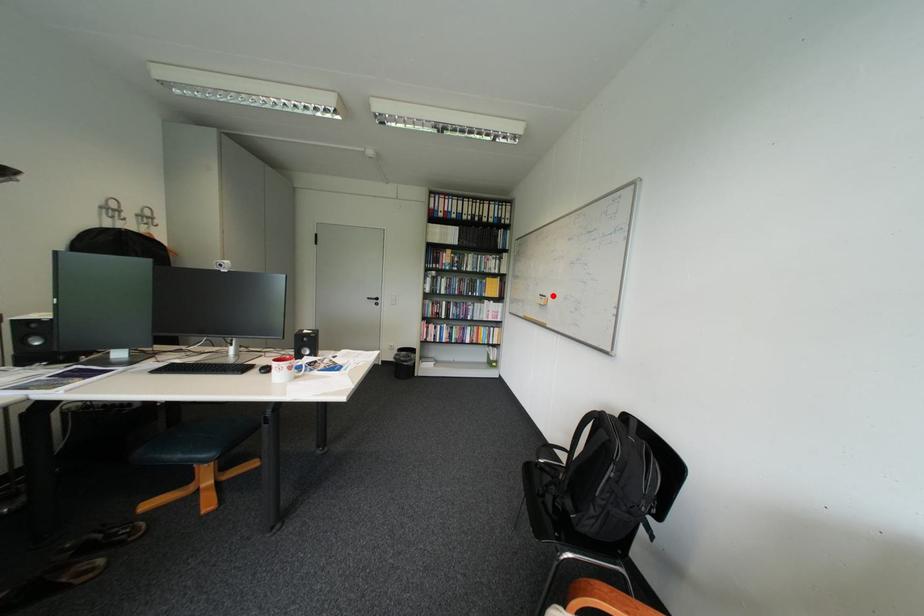
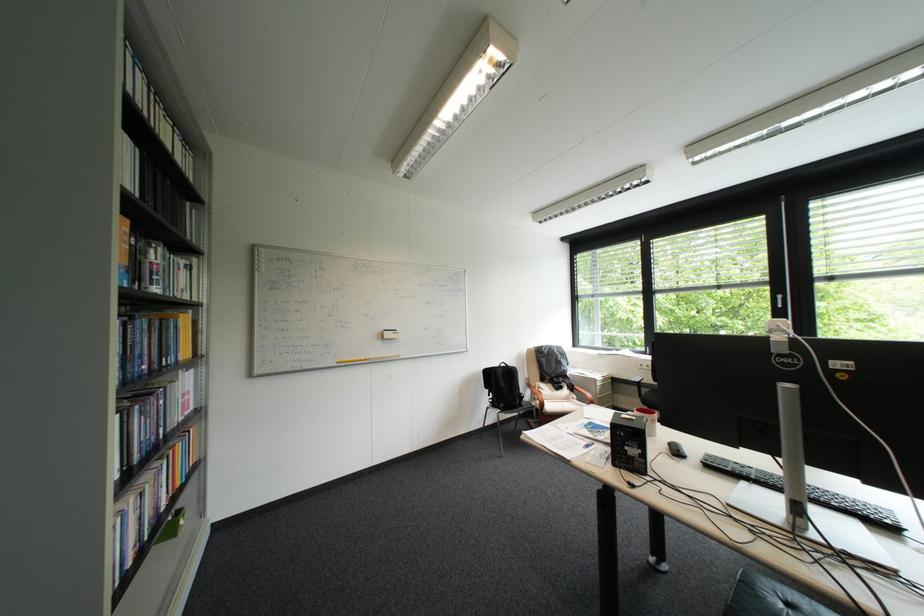
The point at the highlighted location is marked in the first image. Where is the corresponding point in the second image?

(397, 331)